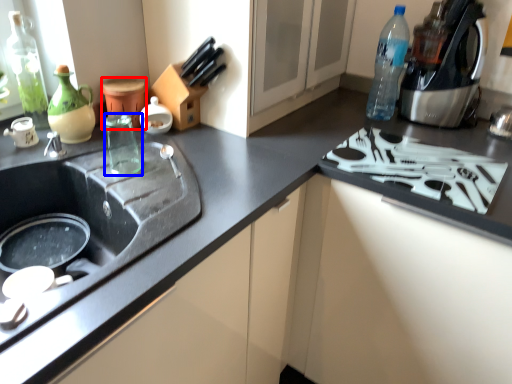
Question: Among these objects, which one is farthest to the camera, appliance (highlighted by a red box) or beverage (highlighted by a blue box)?

Choices:
 (A) appliance
 (B) beverage

Answer: (A)